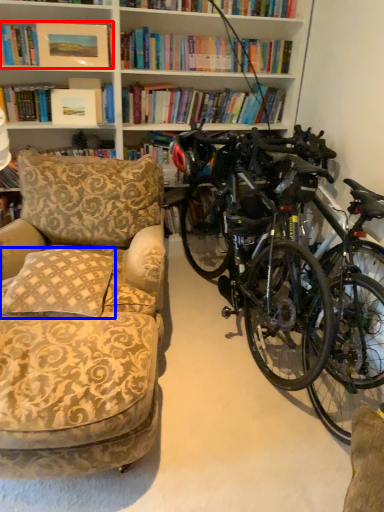
Question: Among these objects, which one is nearest to the camera, book (highlighted by a red box) or pillow (highlighted by a blue box)?

Choices:
 (A) book
 (B) pillow

Answer: (B)